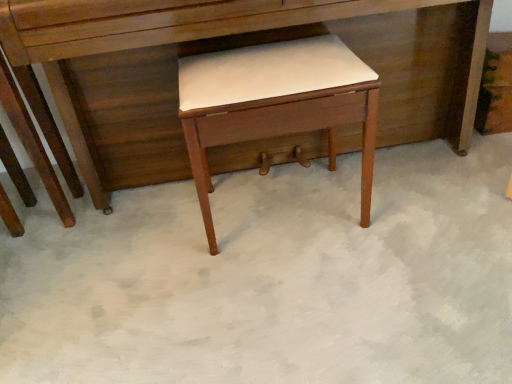
What do you see at coordinates (149, 36) in the screenshot?
I see `matte wood desk at center` at bounding box center [149, 36].

What is the approximate height of matte wood desk at center?

It is 73.69 centimeters.

This screenshot has height=384, width=512. What are the coordinates of `matte wood desk at center` in the screenshot? It's located at (149, 36).

Locate an element on the screen. Image resolution: width=512 pixels, height=384 pixels. matte wood stool at center is located at coordinates (275, 103).

Describe the element at coordinates (275, 103) in the screenshot. This screenshot has height=384, width=512. I see `matte wood stool at center` at that location.

In order to face matte wood stool at center, should I rotate leftwards or rightwards?

Rotate right and turn 2.747 degrees.

This screenshot has width=512, height=384. What are the coordinates of `matte wood desk at center` in the screenshot? It's located at (149, 36).

Which object is positioned more to the right, matte wood desk at center or matte wood stool at center?

From the viewer's perspective, matte wood stool at center appears more on the right side.

Which object is more forward, matte wood desk at center or matte wood stool at center?

Positioned in front is matte wood desk at center.

Is point (207, 28) positioned before point (277, 114)?

Yes, it is in front of point (277, 114).

From the image's perspective, which is above, matte wood desk at center or matte wood stool at center?

matte wood desk at center.

From a real-world perspective, is matte wood desk at center positioned under matte wood stool at center based on gravity?

No, from a real-world perspective, matte wood desk at center is not beneath matte wood stool at center.

Between matte wood desk at center and matte wood stool at center, which one has smaller width?

matte wood stool at center is thinner.

Considering the sizes of objects matte wood desk at center and matte wood stool at center in the image provided, who is shorter, matte wood desk at center or matte wood stool at center?

matte wood stool at center is shorter.

Who is smaller, matte wood desk at center or matte wood stool at center?

Smaller between the two is matte wood stool at center.

Is matte wood desk at center not inside matte wood stool at center?

Yes, matte wood desk at center is located beyond the bounds of matte wood stool at center.

Is matte wood desk at center touching matte wood stool at center?

No, matte wood desk at center is not next to matte wood stool at center.

Is matte wood desk at center oriented away from matte wood stool at center?

That's right, matte wood desk at center is facing away from matte wood stool at center.

How different are the orientations of matte wood desk at center and matte wood stool at center in degrees?

The angular difference between matte wood desk at center and matte wood stool at center is 0.573 degrees.

Find the location of a particular element. desk located in front of the matte wood stool at center is located at coordinates (149, 36).

Based on the photo, is matte wood stool at center at the right side of matte wood desk at center?

Indeed, matte wood stool at center is positioned on the right side of matte wood desk at center.

Is matte wood stool at center positioned in front of matte wood desk at center?

That is False.

Considering the positions of point (251, 114) and point (232, 15), is point (251, 114) closer or farther from the camera than point (232, 15)?

Point (251, 114) appears to be closer to the viewer than point (232, 15).

From the image's perspective, which object appears higher, matte wood stool at center or matte wood desk at center?

matte wood desk at center appears higher in the image.

From a real-world perspective, which is physically below, matte wood stool at center or matte wood desk at center?

From a 3D spatial view, matte wood stool at center is below.

Which object is thinner, matte wood stool at center or matte wood desk at center?

matte wood stool at center.

Who is taller, matte wood stool at center or matte wood desk at center?

Standing taller between the two is matte wood desk at center.

Between matte wood stool at center and matte wood desk at center, which one has larger size?

matte wood desk at center is bigger.

Is matte wood stool at center not within matte wood desk at center?

No, matte wood stool at center is inside matte wood desk at center's boundary.

Based on the photo, is matte wood stool at center far away from matte wood desk at center?

That's not correct — matte wood stool at center is a little close to matte wood desk at center.

Based on the photo, could you tell me if matte wood stool at center is facing matte wood desk at center?

Yes, matte wood stool at center is turned towards matte wood desk at center.

The width and height of the screenshot is (512, 384). Find the location of `desk in front of the matte wood stool at center`. desk in front of the matte wood stool at center is located at coordinates (149, 36).

Where is `desk above the matte wood stool at center (from the image's perspective)`? The width and height of the screenshot is (512, 384). desk above the matte wood stool at center (from the image's perspective) is located at coordinates (149, 36).

Locate an element on the screen. table that appears below the matte wood desk at center (from the image's perspective) is located at coordinates click(275, 103).